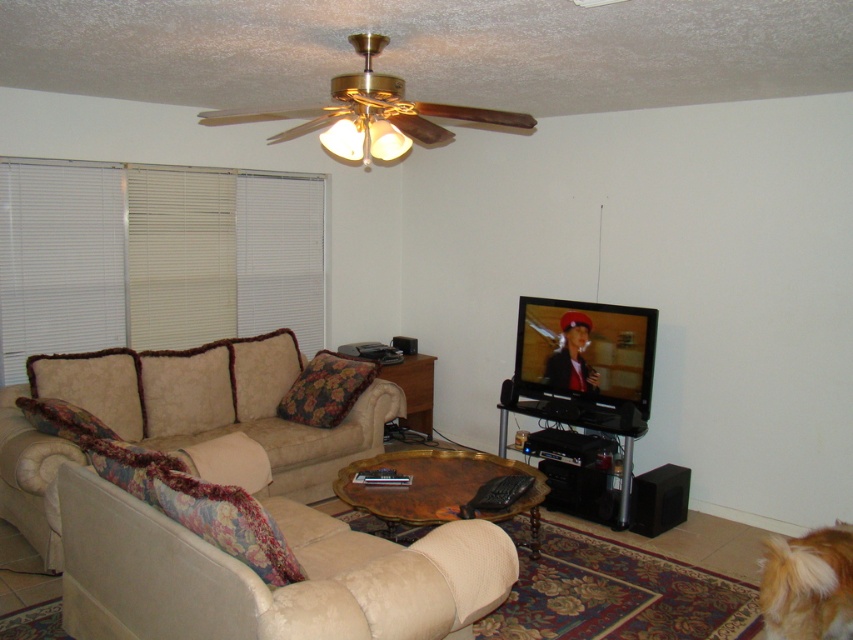
Who is positioned more to the right, beige velvety armchair at lower left or beige fabric couch at lower left?

beige velvety armchair at lower left

Who is taller, beige velvety armchair at lower left or beige fabric couch at lower left?

beige fabric couch at lower left

Which is behind, point (71, 609) or point (303, 465)?

Point (303, 465)

The image size is (853, 640). I want to click on beige velvety armchair at lower left, so click(x=262, y=580).

Which is more to the left, beige fabric couch at lower left or golden fur dog at lower right?

beige fabric couch at lower left is more to the left.

Is beige fabric couch at lower left closer to the viewer compared to golden fur dog at lower right?

No, beige fabric couch at lower left is further to the viewer.

Which is behind, point (187, 352) or point (798, 564)?

Positioned behind is point (187, 352).

The image size is (853, 640). Identify the location of beige fabric couch at lower left. (180, 419).

Does beige velvety armchair at lower left have a lesser width compared to beige fabric side table at center?

Incorrect, beige velvety armchair at lower left's width is not less than beige fabric side table at center's.

Who is more forward, (462, 541) or (428, 397)?

Point (462, 541)

The width and height of the screenshot is (853, 640). Find the location of `beige velvety armchair at lower left`. beige velvety armchair at lower left is located at coordinates (262, 580).